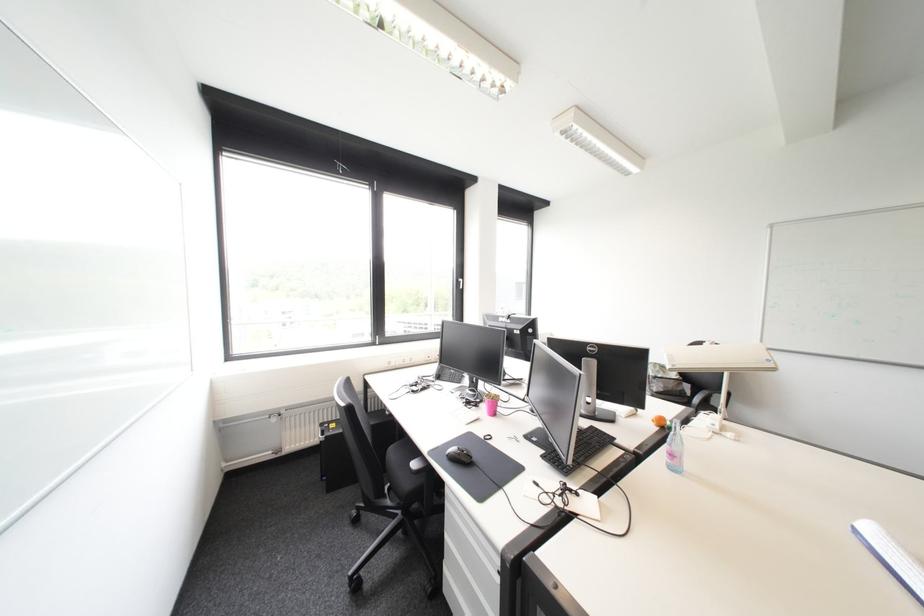
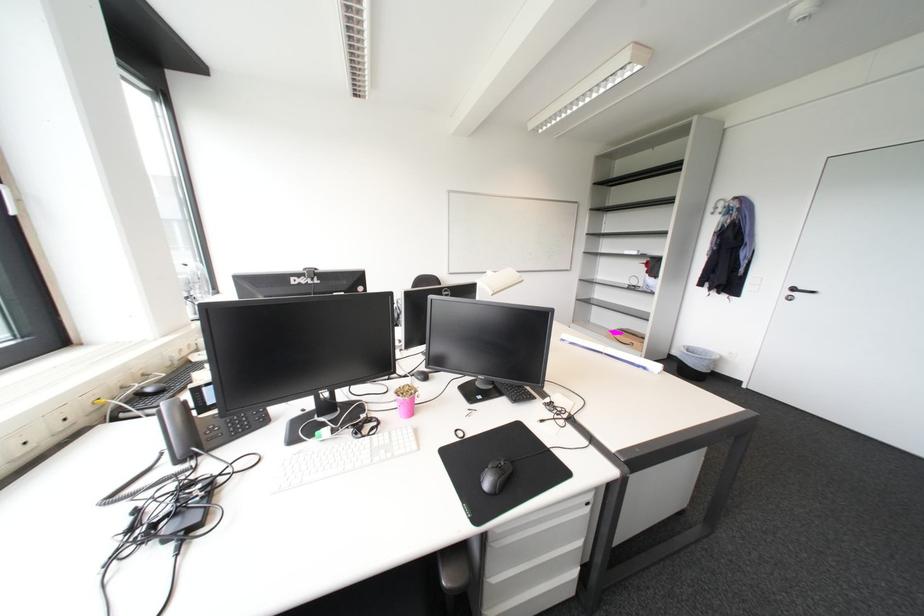
Find the pixel in the second image that matches (x=476, y=407) in the first image.

(379, 436)